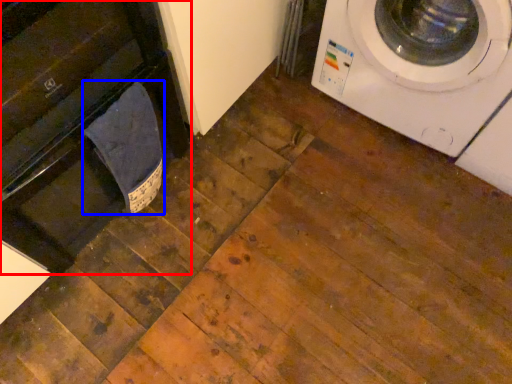
Question: Which point is further to the camera, dish washer (highlighted by a red box) or laundry (highlighted by a blue box)?

Choices:
 (A) dish washer
 (B) laundry

Answer: (B)